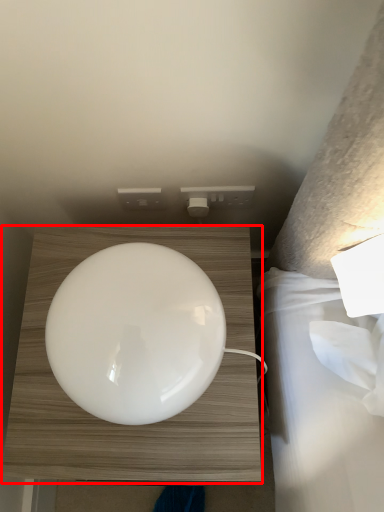
Question: Where is furniture (annotated by the red box) located in relation to electric outlet in the image?

Choices:
 (A) left
 (B) right

Answer: (A)